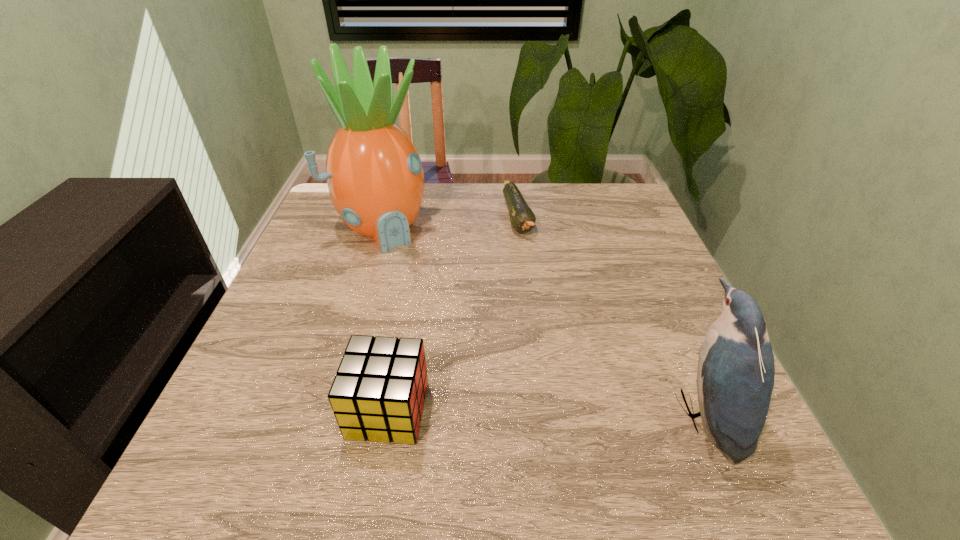
What are the coordinates of `vacant space located 0.370m at the entrance of the pineapple` in the screenshot? It's located at (471, 345).

Locate an element on the screen. Image resolution: width=960 pixels, height=540 pixels. vacant region located at the entrance of the pineapple is located at coordinates (433, 292).

The image size is (960, 540). I want to click on vacant space located 0.100m at the entrance of the pineapple, so click(417, 271).

In order to click on vacant space located 0.180m at the blossom end of the third object from left to right in this screenshot , I will do `click(537, 289)`.

You are a GUI agent. You are given a task and a screenshot of the screen. Output one action in this format:
    pyautogui.click(x=<x>, y=<y>)
    Task: Click on the vacant point located 0.120m at the blossom end of the third object from left to right
    
    Given the screenshot: What is the action you would take?
    pyautogui.click(x=532, y=272)

Image resolution: width=960 pixels, height=540 pixels. I want to click on vacant space located 0.190m at the blossom end of the third object from left to right, so click(538, 292).

Find the location of a particular element. The width and height of the screenshot is (960, 540). pineapple that is at the far edge is located at coordinates [374, 174].

Identify the location of zucchini located in the far edge section of the desktop. (522, 218).

Find the location of a particular element. This screenshot has height=540, width=960. cube positioned at the near edge is located at coordinates [378, 393].

Find the location of a particular element. This screenshot has width=960, height=540. bird that is at the near edge is located at coordinates (735, 378).